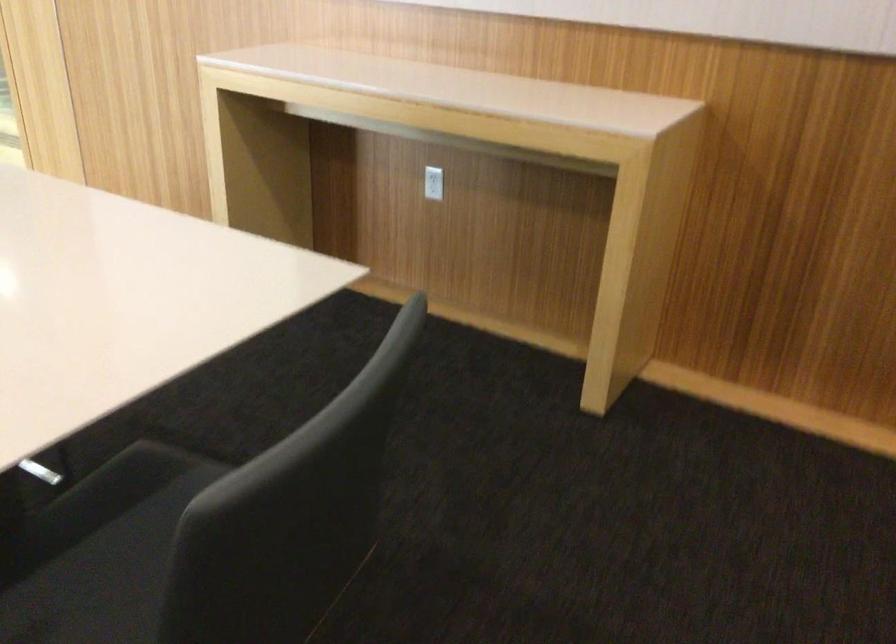
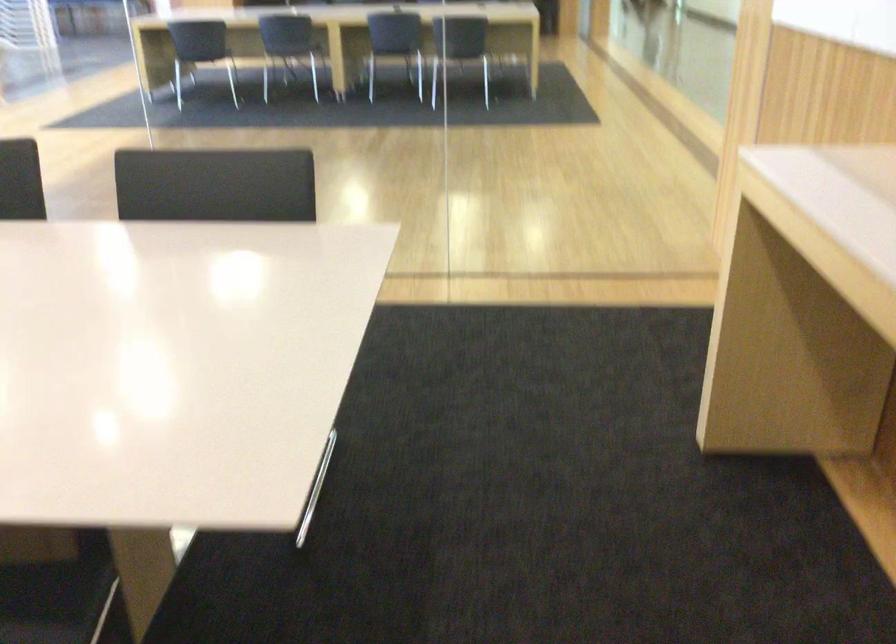
The point at (147,478) is marked in the first image. Where is the corresponding point in the second image?

(55, 601)